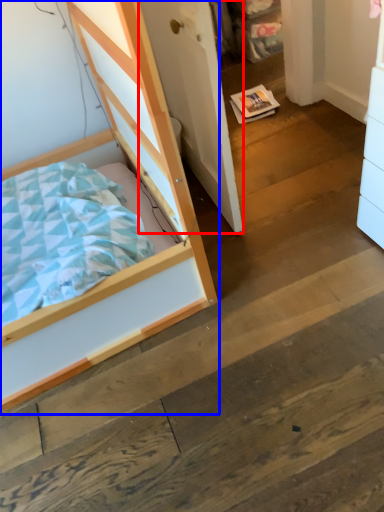
Question: Among these objects, which one is farthest to the camera, door (highlighted by a red box) or bed (highlighted by a blue box)?

Choices:
 (A) door
 (B) bed

Answer: (A)